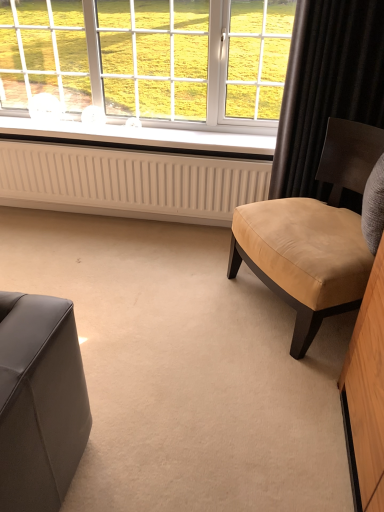
Question: Does tan leather chair at right lie in front of black velvet curtain at upper right?

Choices:
 (A) yes
 (B) no

Answer: (A)

Question: Is tan leather chair at right not within black velvet curtain at upper right?

Choices:
 (A) no
 (B) yes

Answer: (B)

Question: Can you confirm if tan leather chair at right is shorter than black velvet curtain at upper right?

Choices:
 (A) no
 (B) yes

Answer: (B)

Question: Can you confirm if tan leather chair at right is thinner than black velvet curtain at upper right?

Choices:
 (A) yes
 (B) no

Answer: (B)

Question: From a real-world perspective, is tan leather chair at right over black velvet curtain at upper right?

Choices:
 (A) no
 (B) yes

Answer: (A)

Question: From a real-world perspective, is white plastic window sill at center positioned above or below tan leather chair at right?

Choices:
 (A) below
 (B) above

Answer: (B)

Question: Would you say white plastic window sill at center is to the left or to the right of tan leather chair at right in the picture?

Choices:
 (A) left
 (B) right

Answer: (A)

Question: Is point (152, 136) positioned closer to the camera than point (352, 267)?

Choices:
 (A) farther
 (B) closer

Answer: (A)

Question: Considering the positions of white plastic window sill at center and tan leather chair at right in the image, is white plastic window sill at center taller or shorter than tan leather chair at right?

Choices:
 (A) short
 (B) tall

Answer: (A)

Question: Relative to black velvet curtain at upper right, is white ribbed radiator at center in front or behind?

Choices:
 (A) behind
 (B) front

Answer: (A)

Question: Is white ribbed radiator at center inside the boundaries of black velvet curtain at upper right, or outside?

Choices:
 (A) outside
 (B) inside

Answer: (A)

Question: Is white ribbed radiator at center wider or thinner than black velvet curtain at upper right?

Choices:
 (A) thin
 (B) wide

Answer: (A)

Question: Considering the positions of point (134, 159) and point (345, 117), is point (134, 159) closer or farther from the camera than point (345, 117)?

Choices:
 (A) closer
 (B) farther

Answer: (B)

Question: Based on their positions, is white plastic window sill at center located to the left or right of white ribbed radiator at center?

Choices:
 (A) left
 (B) right

Answer: (A)

Question: Is white plastic window sill at center inside or outside of white ribbed radiator at center?

Choices:
 (A) inside
 (B) outside

Answer: (B)